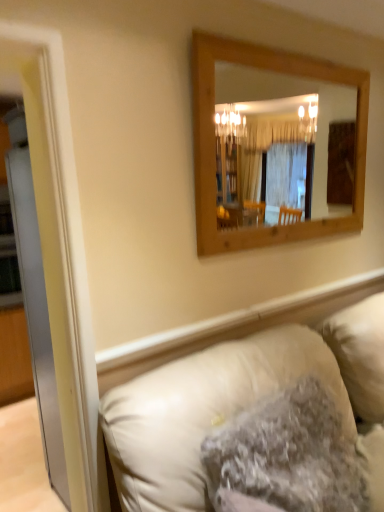
You are a GUI agent. You are given a task and a screenshot of the screen. Output one action in this format:
    pyautogui.click(x=<x>, y=<y>)
    Task: Click on the empty space that is ontop of wooden mirror at upper center
    The width and height of the screenshot is (384, 512).
    Given the screenshot: What is the action you would take?
    pyautogui.click(x=288, y=50)